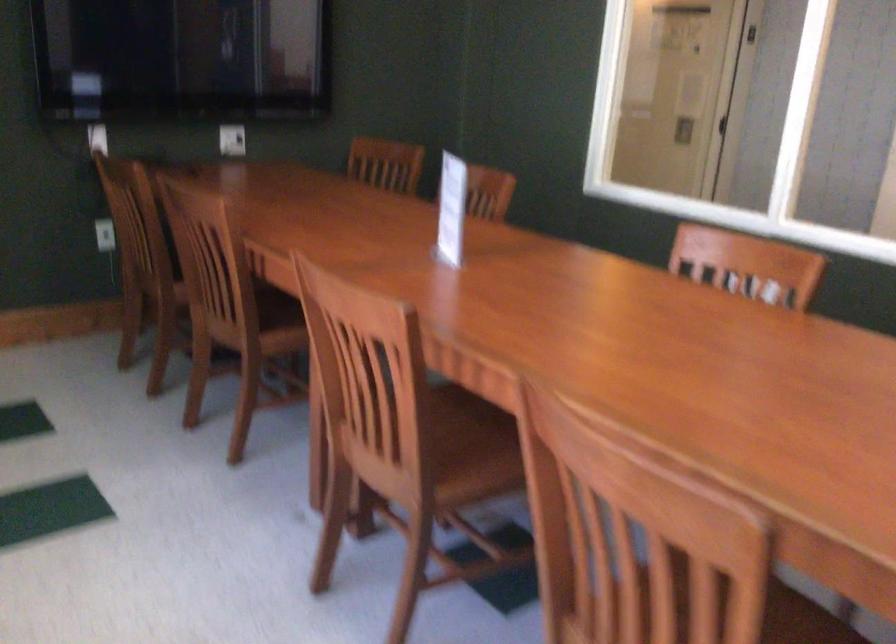
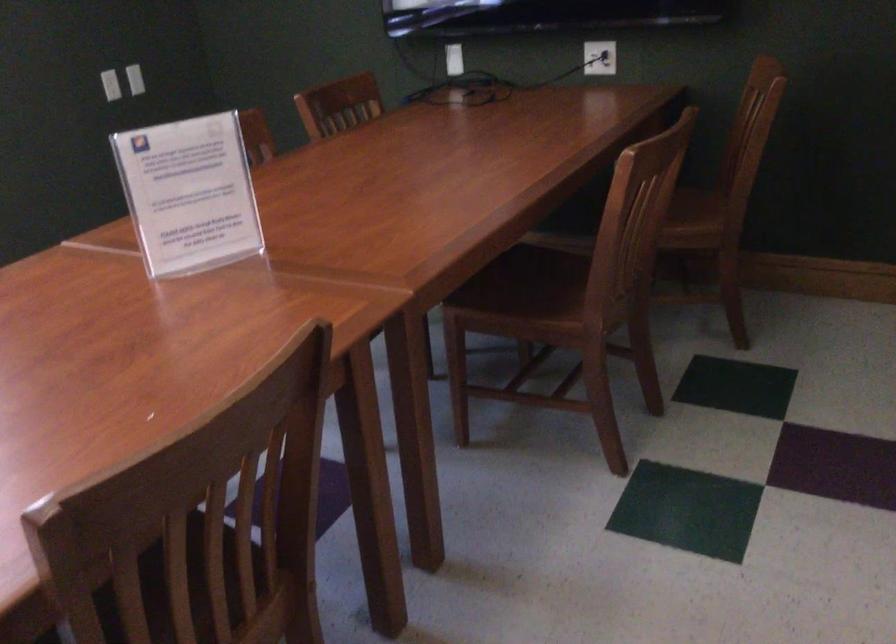
The point at (446,207) is marked in the first image. Where is the corresponding point in the second image?

(188, 194)